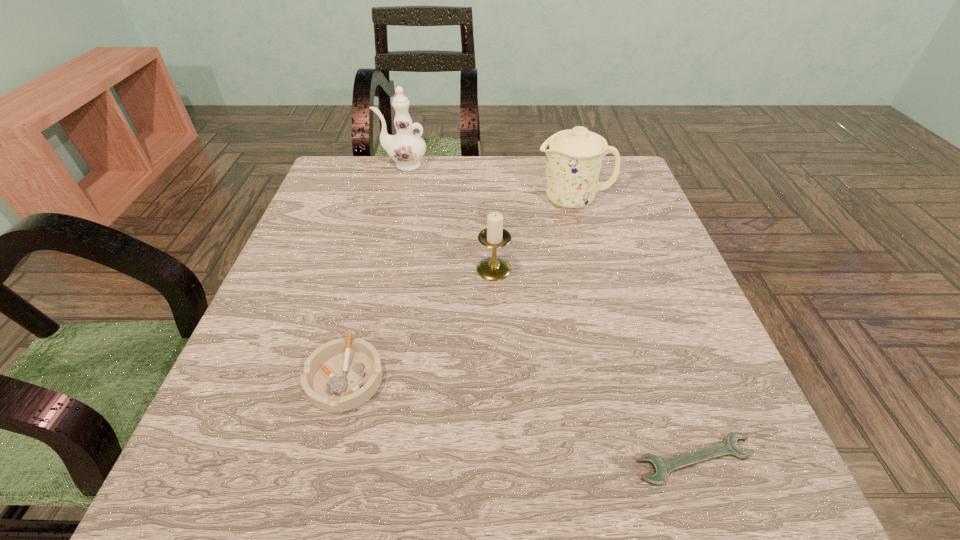
Locate an element on the screen. vacant region that satisfies the following two spatial constraints: 1. at the spout of the farther chinaware; 2. on the back side of the candle holder is located at coordinates (377, 269).

In order to click on free region that satisfies the following two spatial constraints: 1. on the spout of the nearer chinaware; 2. on the front side of the ashtray in this screenshot , I will do `click(620, 377)`.